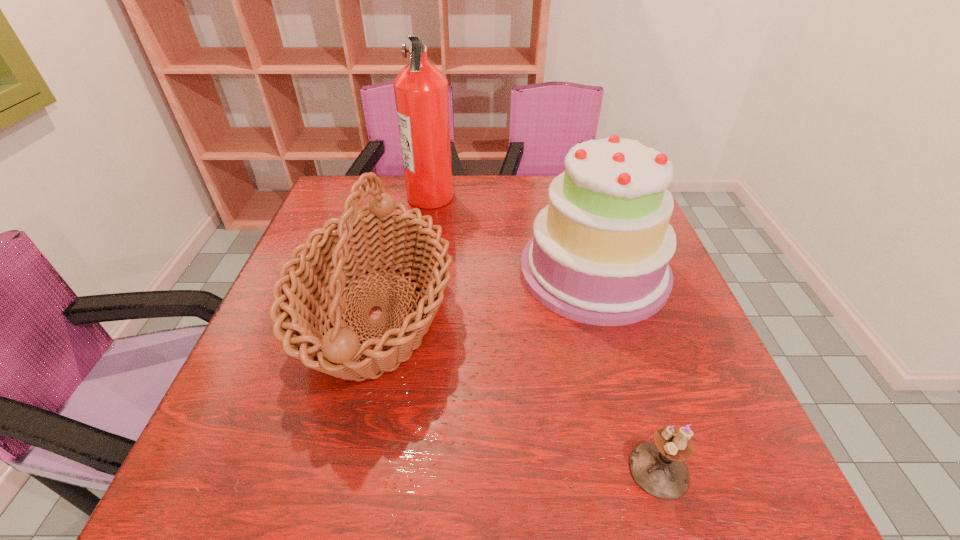
The image size is (960, 540). Find the location of `fire extinguisher`. fire extinguisher is located at coordinates (421, 93).

Locate an element on the screen. The height and width of the screenshot is (540, 960). the farthest object is located at coordinates (421, 93).

Find the location of a particular element. cake is located at coordinates (600, 253).

You are a GUI agent. You are given a task and a screenshot of the screen. Output one action in this format:
    pyautogui.click(x=<x>, y=<y>)
    Task: Click on the basket
    
    Given the screenshot: What is the action you would take?
    pyautogui.click(x=358, y=240)

The width and height of the screenshot is (960, 540). I want to click on the shortest object, so click(659, 468).

Locate an element on the screen. the nearest object is located at coordinates (659, 468).

This screenshot has height=540, width=960. I want to click on vacant space positioned 0.050m at the nozzle of the fire extinguisher, so (x=469, y=196).

Locate an element on the screen. This screenshot has width=960, height=540. vacant space located 0.080m on the back of the cake is located at coordinates (577, 212).

Where is `free region located on the right of the basket`? This screenshot has height=540, width=960. free region located on the right of the basket is located at coordinates (572, 315).

This screenshot has width=960, height=540. Find the location of `free space located 0.050m on the back of the nearest object`. free space located 0.050m on the back of the nearest object is located at coordinates (642, 415).